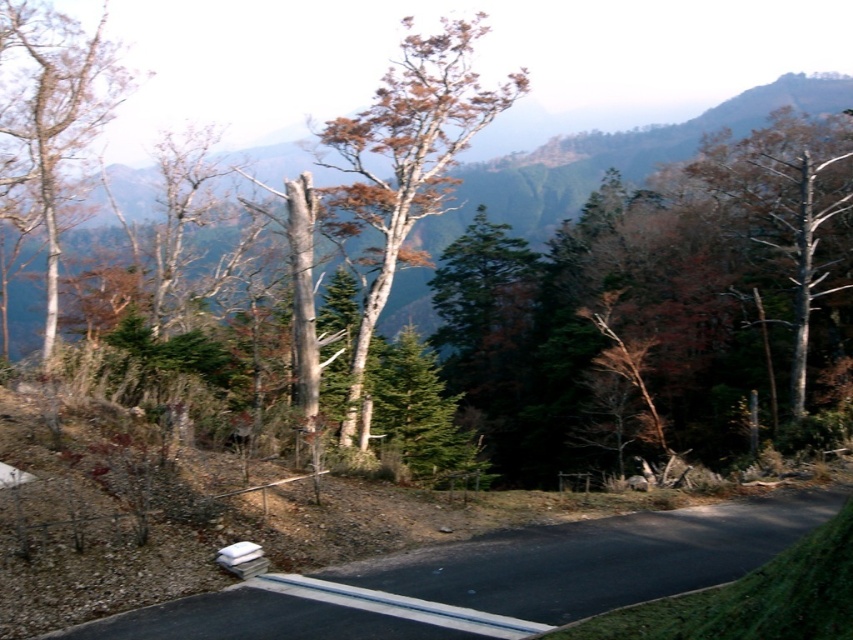
Question: Can you confirm if brown bark tree at center is positioned above smooth white tree at left?

Choices:
 (A) yes
 (B) no

Answer: (A)

Question: Which point is farther to the camera?

Choices:
 (A) black asphalt road at lower center
 (B) brown bark tree at center

Answer: (B)

Question: Which point is closer to the camera?

Choices:
 (A) (33, 49)
 (B) (828, 502)
 (C) (344, 186)

Answer: (B)

Question: Which point appears closest to the camera in this image?

Choices:
 (A) (16, 198)
 (B) (721, 580)

Answer: (B)

Question: Does brown bark tree at center appear under smooth white tree at left?

Choices:
 (A) yes
 (B) no

Answer: (B)

Question: Does brown bark tree at center appear under smooth white tree at left?

Choices:
 (A) no
 (B) yes

Answer: (A)